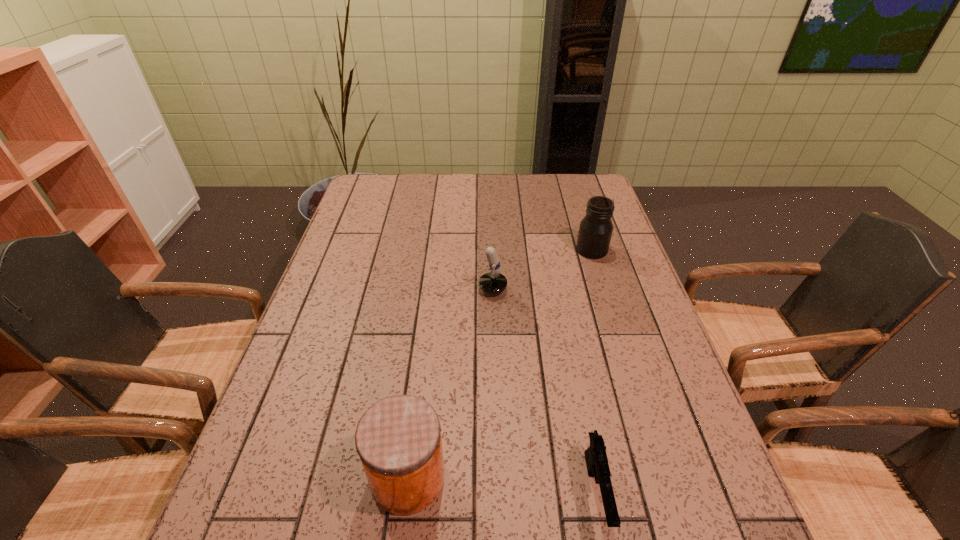
In order to click on the rightmost object in this screenshot , I will do `click(596, 228)`.

Identify the location of the farther jar. [x=596, y=228].

The image size is (960, 540). In order to click on the nearer jar in this screenshot , I will do `click(398, 439)`.

This screenshot has height=540, width=960. What are the coordinates of `the second farthest object` in the screenshot? It's located at (493, 282).

Locate an element on the screen. The height and width of the screenshot is (540, 960). microphone is located at coordinates (493, 282).

The image size is (960, 540). I want to click on vacant position located on the back of the right jar, so click(x=584, y=223).

Where is `vacant space located 0.160m on the left of the left jar`? vacant space located 0.160m on the left of the left jar is located at coordinates (287, 477).

Locate an element on the screen. vacant space situated on the front of the microphone is located at coordinates (471, 354).

I want to click on object that is at the right edge, so click(596, 228).

Locate an element on the screen. vacant region at the far edge of the desktop is located at coordinates (429, 177).